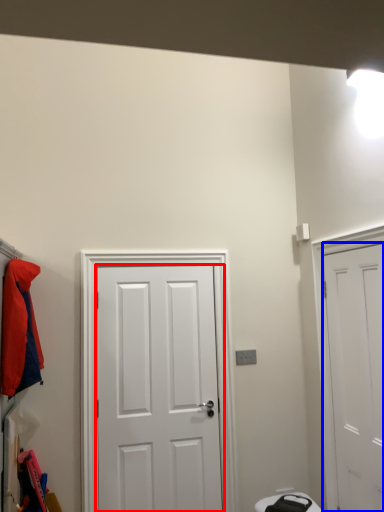
Question: Among these objects, which one is nearest to the camera, door (highlighted by a red box) or door (highlighted by a blue box)?

Choices:
 (A) door
 (B) door

Answer: (B)